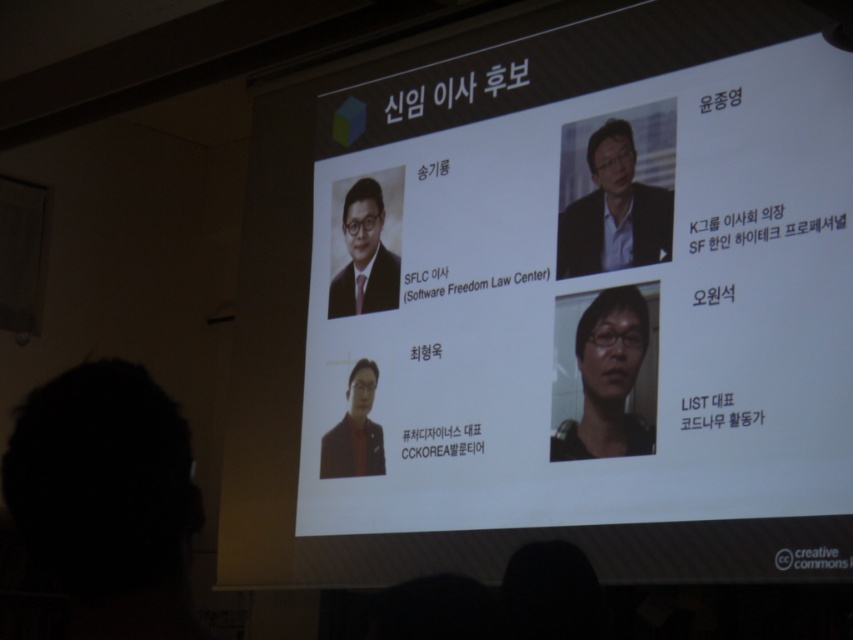
Based on the photo, you are a presenter standing at the front of the room facing the screen. You need to reach both the matte black laptop at upper center and the matte black suit at upper right to adjust their positions. Which object is closer to your current position?

The matte black laptop at upper center is closer to your current position because it is located at the upper center of the screen, whereas the matte black suit at upper right is positioned further to the right. Since you are facing the screen, the central object would be nearer in terms of horizontal distance.